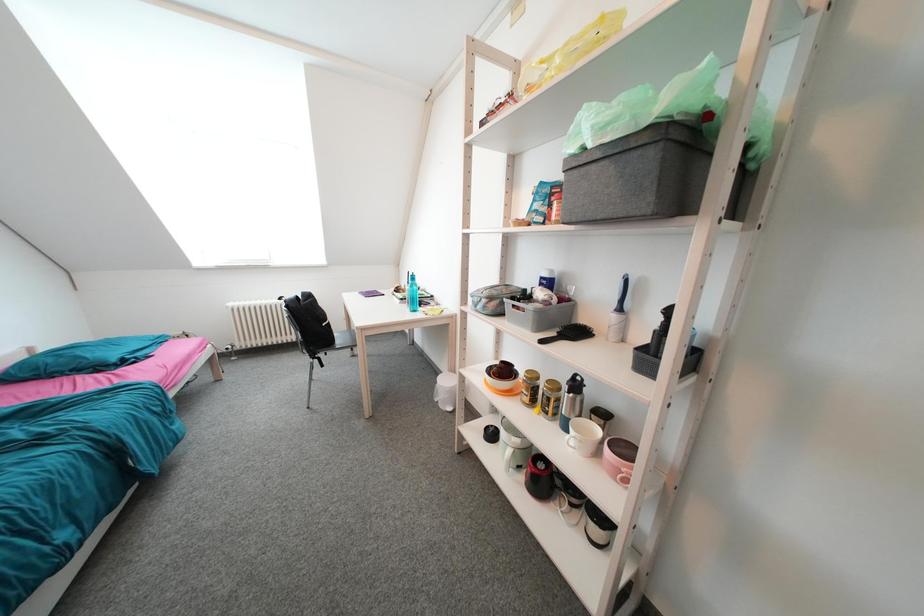
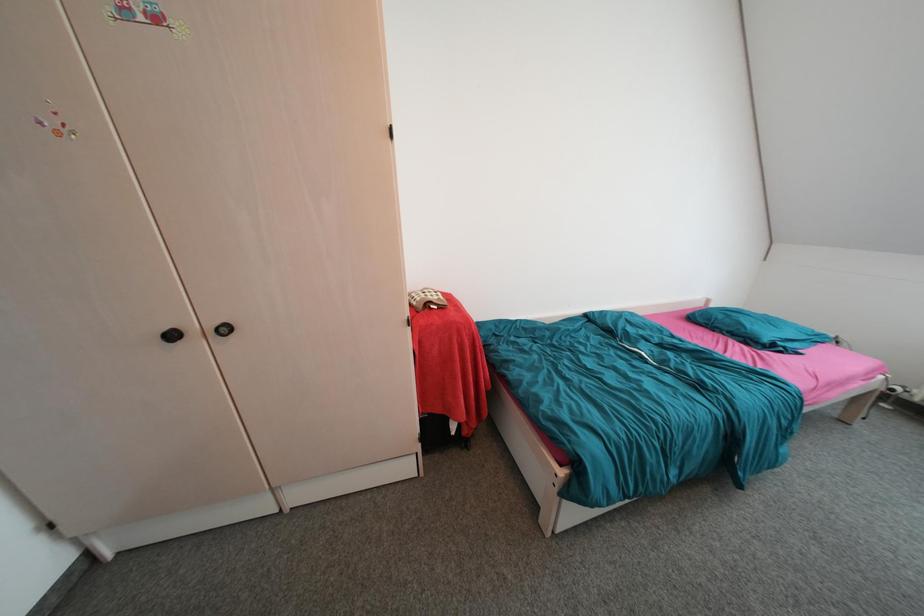
How did the camera likely rotate?

The camera rotated toward left-down.